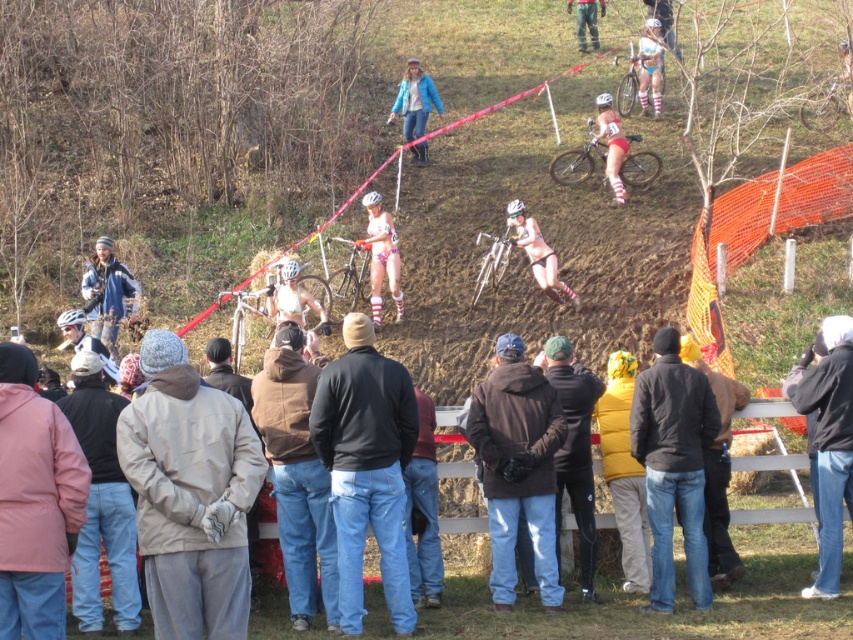
Does light gray jacket at lower left have a larger size compared to matte black helmet at left?

Yes, light gray jacket at lower left is bigger than matte black helmet at left.

I want to click on light gray jacket at lower left, so click(x=102, y=502).

Consider the image. Can you confirm if light gray jacket at lower left is taller than blue denim jacket at upper center?

Yes, light gray jacket at lower left is taller than blue denim jacket at upper center.

Which is in front, point (97, 579) or point (410, 76)?

Positioned in front is point (97, 579).

Where is `light gray jacket at lower left`? The height and width of the screenshot is (640, 853). light gray jacket at lower left is located at coordinates (102, 502).

Can you confirm if light gray jacket at lower left is wider than matte pink bicycle at upper center?

No, light gray jacket at lower left is not wider than matte pink bicycle at upper center.

Who is positioned more to the left, light gray jacket at lower left or matte pink bicycle at upper center?

Positioned to the left is light gray jacket at lower left.

Is point (73, 428) positioned behind point (561, 154)?

No, it is not.

This screenshot has height=640, width=853. I want to click on light gray jacket at lower left, so click(x=102, y=502).